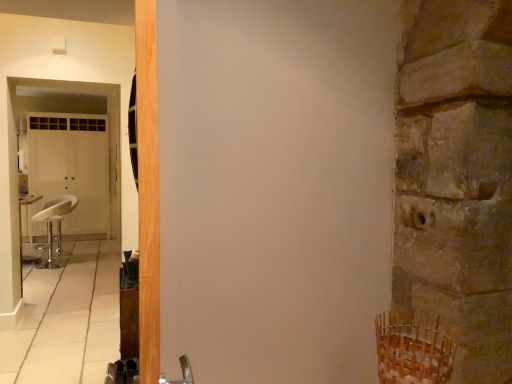
Measure the distance between white leather stool at left and camera.

white leather stool at left is 5.88 meters from camera.

The image size is (512, 384). Describe the element at coordinates (52, 224) in the screenshot. I see `white leather stool at left` at that location.

The height and width of the screenshot is (384, 512). I want to click on white leather stool at left, so click(x=52, y=224).

Find the location of `white leather stool at left`. white leather stool at left is located at coordinates (52, 224).